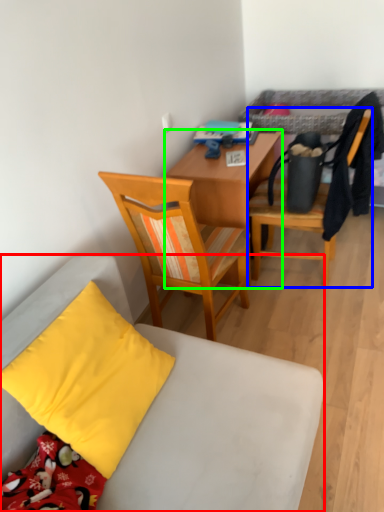
Question: Which object is the farthest from chair (highlighted by a red box)? Choose among these: chair (highlighted by a blue box) or desk (highlighted by a green box).

Choices:
 (A) chair
 (B) desk

Answer: (A)